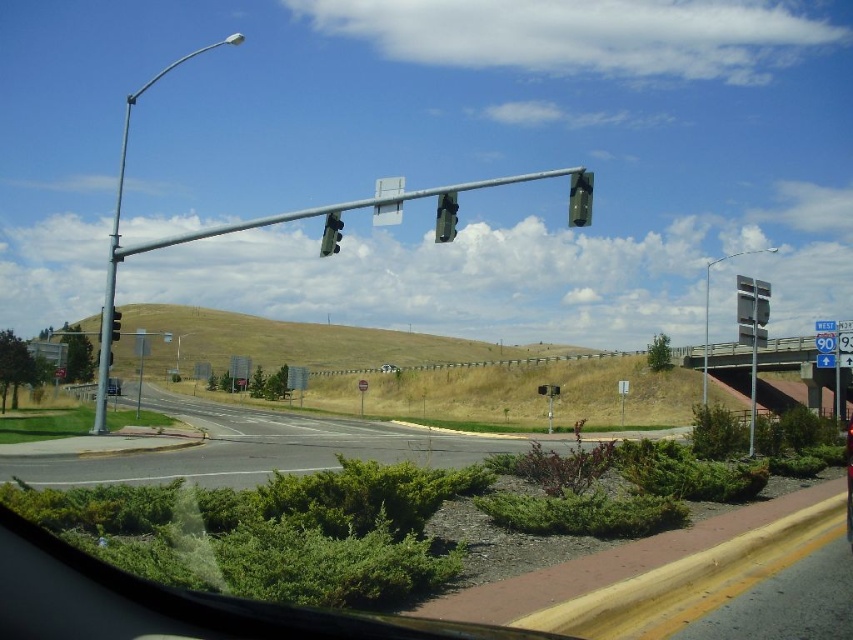
This screenshot has width=853, height=640. Find the location of `metallic pole at left`. metallic pole at left is located at coordinates (119, 234).

Where is `metallic pole at left`? The width and height of the screenshot is (853, 640). metallic pole at left is located at coordinates (119, 234).

Is point (746, 321) closer to viewer compared to point (177, 355)?

Yes, point (746, 321) is in front of point (177, 355).

At what (x,y) coordinates should I click in order to perform the action: click on metallic gray traffic light at upper center. Please return your answer as a coordinate pair (x, y). Looking at the image, I should click on 747,300.

Where is `metallic gray traffic light at upper center`? metallic gray traffic light at upper center is located at coordinates coord(747,300).

Is metallic gray traffic light at upper center shorter than metallic gray sign at upper right?

Yes, metallic gray traffic light at upper center is shorter than metallic gray sign at upper right.

Does point (753, 292) come in front of point (738, 252)?

Yes, point (753, 292) is in front of point (738, 252).

In order to click on metallic gray traffic light at upper center in this screenshot , I will do `click(747, 300)`.